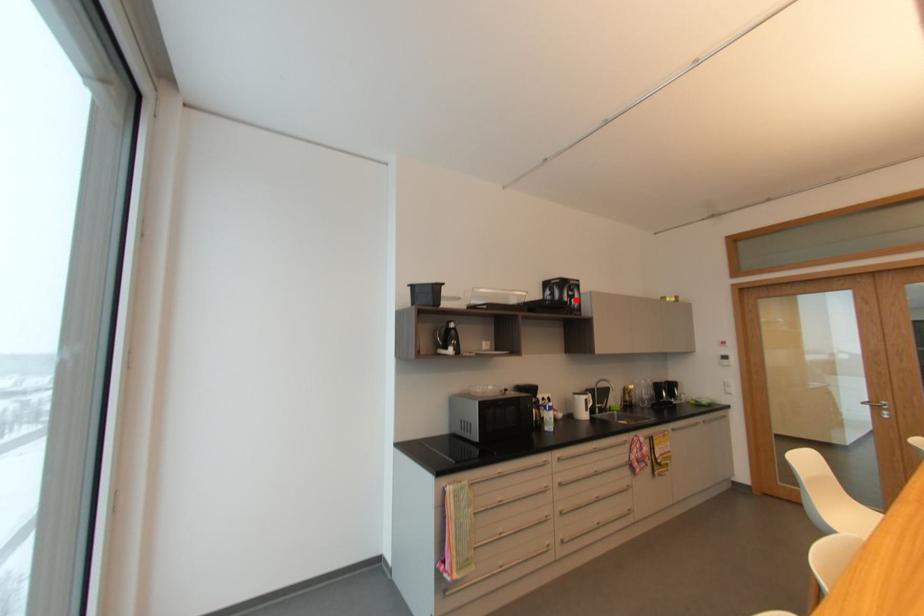
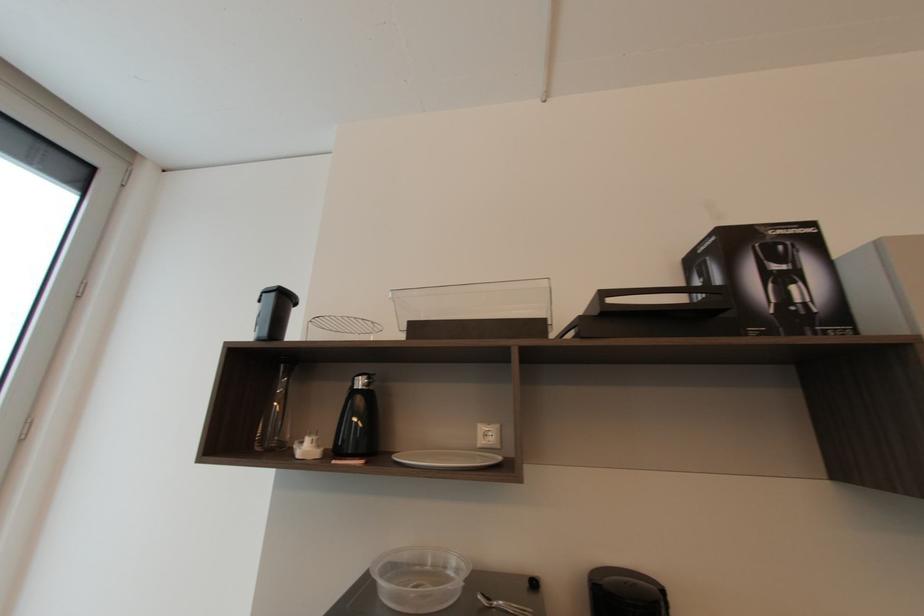
The point at the highlighted location is marked in the first image. Where is the corresponding point in the second image?

(796, 288)